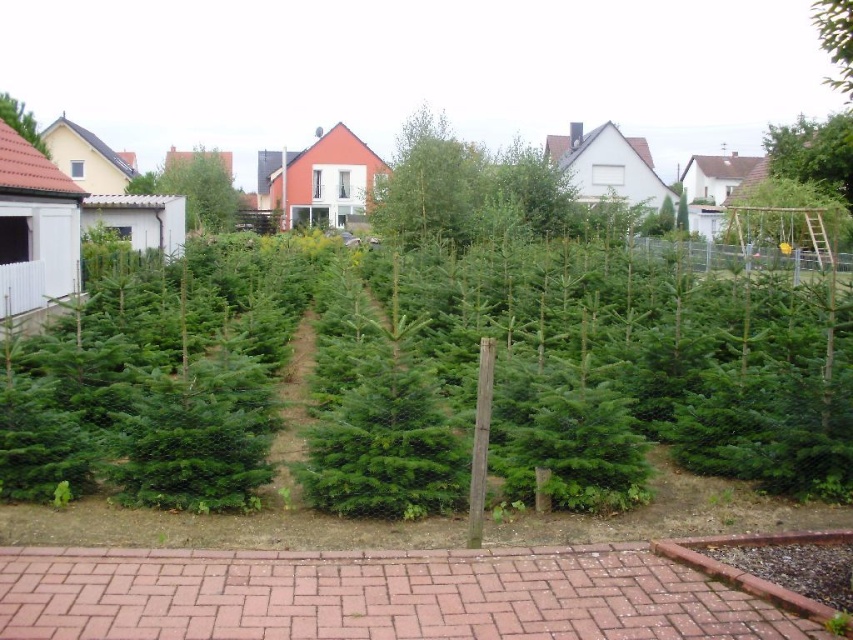
Question: Among these objects, which one is farthest from the camera?

Choices:
 (A) green needle-like at center
 (B) green leafy plants at center

Answer: (A)

Question: Which point is closer to the camera taking this photo?

Choices:
 (A) (790, 168)
 (B) (9, 106)
 (C) (212, 212)
 (D) (845, 1)

Answer: (D)

Question: Can you confirm if green needle-like at center is bigger than green matte tree at upper right?

Choices:
 (A) yes
 (B) no

Answer: (B)

Question: Based on their relative distances, which object is nearer to the green needle-like at center?

Choices:
 (A) green matte tree at upper right
 (B) green leafy plants at center
 (C) green needle-like at upper left

Answer: (C)

Question: Considering the relative positions of green leafy plants at center and green needle-like at upper left in the image provided, where is green leafy plants at center located with respect to green needle-like at upper left?

Choices:
 (A) above
 (B) below

Answer: (B)

Question: Does green leafy tree at upper right appear on the left side of green matte tree at upper right?

Choices:
 (A) no
 (B) yes

Answer: (A)